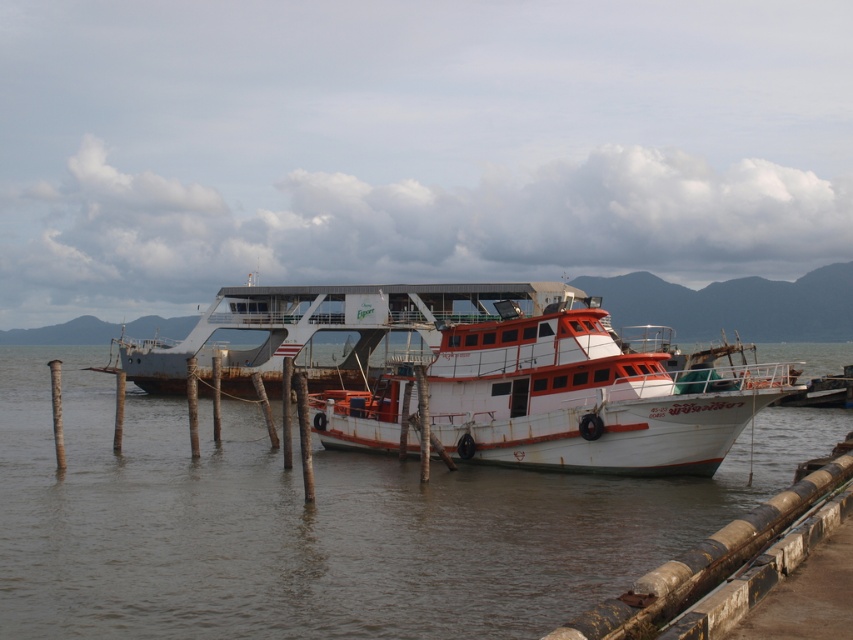
Question: Which object is farther from the camera taking this photo?

Choices:
 (A) rusty metallic water at center
 (B) rusty metal ferry at center
 (C) white matte boat at center

Answer: (B)

Question: Which is nearer to the rusty metal ferry at center?

Choices:
 (A) rusty metallic water at center
 (B) white matte boat at center

Answer: (B)

Question: Can you confirm if rusty metallic water at center is positioned to the left of rusty metal ferry at center?

Choices:
 (A) yes
 (B) no

Answer: (A)

Question: Which object is closer to the camera taking this photo?

Choices:
 (A) rusty metal ferry at center
 (B) rusty metallic water at center

Answer: (B)

Question: Can you confirm if white matte boat at center is smaller than rusty metal ferry at center?

Choices:
 (A) yes
 (B) no

Answer: (A)

Question: Where is rusty metallic water at center located in relation to white matte boat at center in the image?

Choices:
 (A) left
 (B) right

Answer: (A)